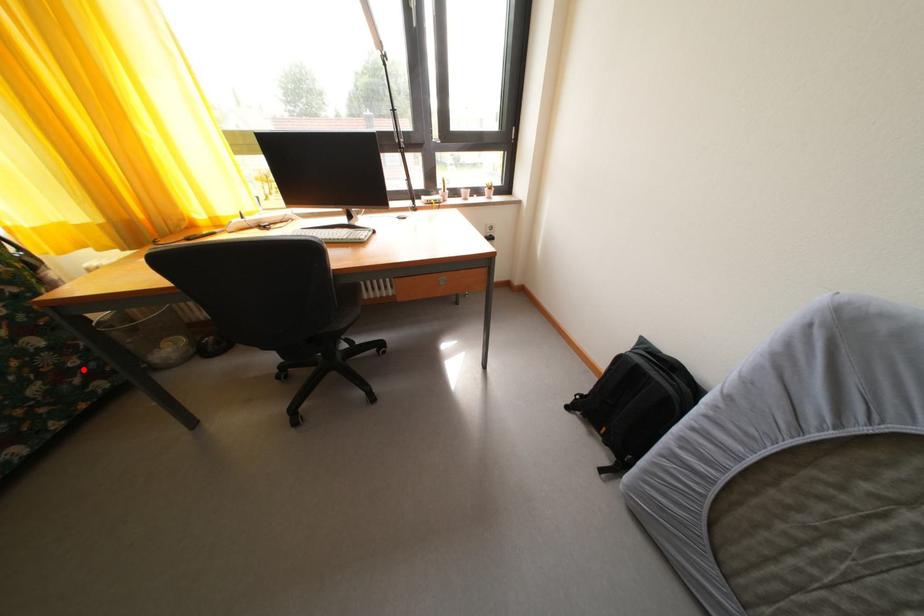
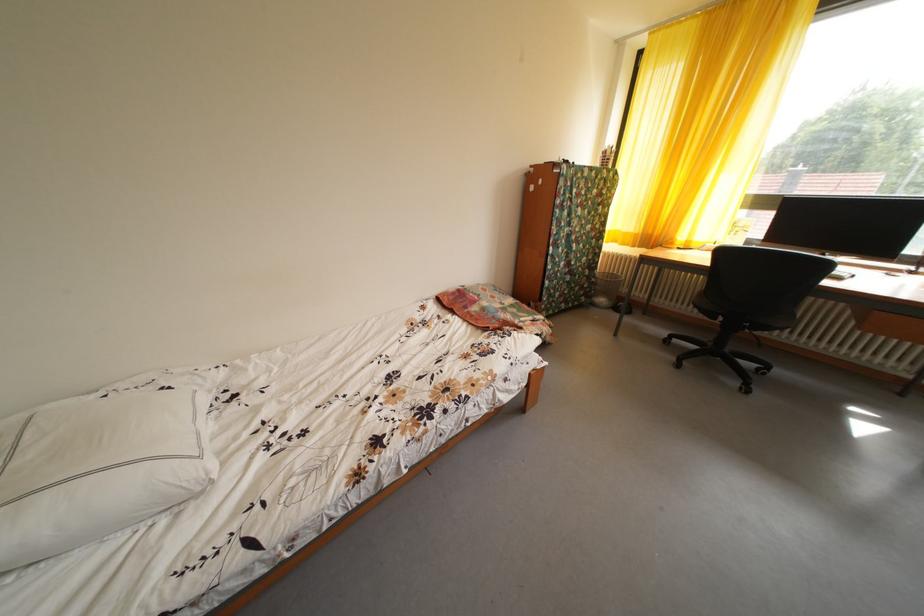
Question: A red point is marked in image1. In image2, is the corresponding 3D point closer to the camera or farther? Reply with the corresponding letter.

Choices:
 (A) The corresponding 3D point is closer.
 (B) The corresponding 3D point is farther.

Answer: (A)